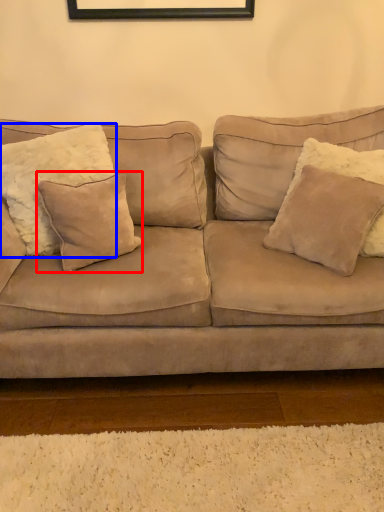
Question: Among these objects, which one is farthest to the camera, pillow (highlighted by a red box) or pillow (highlighted by a blue box)?

Choices:
 (A) pillow
 (B) pillow

Answer: (A)